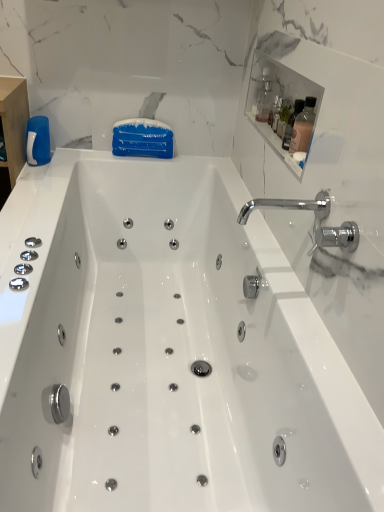
Where is `translucent pink bottle at upper right, the 2th bottle when ordered from back to front`? translucent pink bottle at upper right, the 2th bottle when ordered from back to front is located at coordinates (303, 127).

Measure the distance between point (314, 120) and camera.

A distance of 3.54 feet exists between point (314, 120) and camera.

Describe the element at coordinates (289, 206) in the screenshot. The width and height of the screenshot is (384, 512). I see `chrome/metallic faucet at upper right` at that location.

Where is `chrome/metallic faucet at upper right`? The height and width of the screenshot is (512, 384). chrome/metallic faucet at upper right is located at coordinates pyautogui.click(x=289, y=206).

In order to click on white glossy medicine cabinet at upper right in this screenshot , I will do `click(280, 105)`.

What do you see at coordinates (264, 102) in the screenshot? The width and height of the screenshot is (384, 512). I see `clear glass bottle at upper right, which ranks as the 2th bottle in front-to-back order` at bounding box center [264, 102].

Where is `translucent pink bottle at upper right, acting as the 1th bottle starting from the front`? This screenshot has width=384, height=512. translucent pink bottle at upper right, acting as the 1th bottle starting from the front is located at coordinates (303, 127).

Looking at this image, can you tell me how much clear glass bottle at upper right, the first bottle when ordered from back to front, and translucent pink bottle at upper right, acting as the 1th bottle starting from the front, differ in facing direction?

0.00192 degrees.

Which is behind, point (258, 115) or point (305, 100)?

The point (258, 115) is behind.

Visually, is clear glass bottle at upper right, the 2th bottle from the bottom, positioned to the left or to the right of translucent pink bottle at upper right, the 2th bottle when ordered from back to front?

In the image, clear glass bottle at upper right, the 2th bottle from the bottom, appears on the left side of translucent pink bottle at upper right, the 2th bottle when ordered from back to front.

Where is `bottle above the clear glass bottle at upper right, the first bottle when ordered from back to front (from a real-world perspective)`? Image resolution: width=384 pixels, height=512 pixels. bottle above the clear glass bottle at upper right, the first bottle when ordered from back to front (from a real-world perspective) is located at coordinates (303, 127).

Can you confirm if blue glossy bottle at left is bigger than translucent pink bottle at upper right, the 2th bottle when ordered from back to front?

Yes.

Between blue glossy bottle at left and translucent pink bottle at upper right, marked as the 1th bottle in a bottom-to-top arrangement, which one has more height?

translucent pink bottle at upper right, marked as the 1th bottle in a bottom-to-top arrangement.

Is the surface of blue glossy bottle at left in direct contact with translucent pink bottle at upper right, acting as the 1th bottle starting from the front?

No, blue glossy bottle at left is not next to translucent pink bottle at upper right, acting as the 1th bottle starting from the front.

Starting from the blue glossy bottle at left, which bottle is the 2nd one in front? Please provide its 2D coordinates.

[(303, 127)]

Is translucent pink bottle at upper right, acting as the 1th bottle starting from the front, aimed at white glossy bathtub at center?

No.

Which is more to the left, translucent pink bottle at upper right, marked as the 1th bottle in a bottom-to-top arrangement, or white glossy bathtub at center?

From the viewer's perspective, white glossy bathtub at center appears more on the left side.

Is white glossy bathtub at center surrounded by translucent pink bottle at upper right, marked as the 1th bottle in a bottom-to-top arrangement?

No, white glossy bathtub at center is not surrounded by translucent pink bottle at upper right, marked as the 1th bottle in a bottom-to-top arrangement.

How different are the orientations of translucent pink bottle at upper right, marked as the 1th bottle in a bottom-to-top arrangement, and white glossy bathtub at center in degrees?

0.742 degrees separate the facing orientations of translucent pink bottle at upper right, marked as the 1th bottle in a bottom-to-top arrangement, and white glossy bathtub at center.

Can you tell me how much chrome/metallic faucet at upper right and white glossy medicine cabinet at upper right differ in facing direction?

chrome/metallic faucet at upper right and white glossy medicine cabinet at upper right are facing 0.000904 degrees away from each other.

Consider the image. Is chrome/metallic faucet at upper right inside the boundaries of white glossy medicine cabinet at upper right, or outside?

chrome/metallic faucet at upper right is spatially situated outside white glossy medicine cabinet at upper right.

Can you confirm if chrome/metallic faucet at upper right is taller than white glossy medicine cabinet at upper right?

Yes, chrome/metallic faucet at upper right is taller than white glossy medicine cabinet at upper right.

Does chrome/metallic faucet at upper right come behind white glossy medicine cabinet at upper right?

No, chrome/metallic faucet at upper right is in front of white glossy medicine cabinet at upper right.

In the image, is white glossy medicine cabinet at upper right positioned in front of or behind translucent pink bottle at upper right, which is the second bottle from top to bottom?

Visually, white glossy medicine cabinet at upper right is located in front of translucent pink bottle at upper right, which is the second bottle from top to bottom.

Can you confirm if white glossy medicine cabinet at upper right is taller than translucent pink bottle at upper right, which is the second bottle from top to bottom?

Incorrect, the height of white glossy medicine cabinet at upper right is not larger of that of translucent pink bottle at upper right, which is the second bottle from top to bottom.

Consider the image. From a real-world perspective, relative to translucent pink bottle at upper right, which is the second bottle from top to bottom, is white glossy medicine cabinet at upper right vertically above or below?

white glossy medicine cabinet at upper right is situated lower than translucent pink bottle at upper right, which is the second bottle from top to bottom, in the real world.

Which of these two, white glossy medicine cabinet at upper right or translucent pink bottle at upper right, acting as the 1th bottle starting from the front, is thinner?

Thinner between the two is translucent pink bottle at upper right, acting as the 1th bottle starting from the front.

Is translucent pink bottle at upper right, which is the second bottle from top to bottom, facing towards chrome/metallic faucet at upper right?

No.

Is point (311, 127) less distant than point (329, 209)?

No, (311, 127) is further to viewer.

Looking at this image, considering the sizes of objects translucent pink bottle at upper right, acting as the 1th bottle starting from the front, and chrome/metallic faucet at upper right in the image provided, who is shorter, translucent pink bottle at upper right, acting as the 1th bottle starting from the front, or chrome/metallic faucet at upper right?

With less height is chrome/metallic faucet at upper right.

Is chrome/metallic faucet at upper right positioned behind blue glossy bottle at left?

That is False.

Is chrome/metallic faucet at upper right with blue glossy bottle at left?

No.

Consider the image. Which is nearer, (326, 193) or (42, 121)?

Positioned in front is point (326, 193).

Does chrome/metallic faucet at upper right appear on the right side of blue glossy bottle at left?

Correct, you'll find chrome/metallic faucet at upper right to the right of blue glossy bottle at left.

Where is `bottle above the translucent pink bottle at upper right, which is the second bottle from top to bottom (from the image's perspective)`? Image resolution: width=384 pixels, height=512 pixels. bottle above the translucent pink bottle at upper right, which is the second bottle from top to bottom (from the image's perspective) is located at coordinates (264, 102).

The height and width of the screenshot is (512, 384). I want to click on cleaning product that appears on the left of translucent pink bottle at upper right, which is the second bottle from top to bottom, so click(38, 141).

Estimate the real-world distances between objects in this image. Which object is further from translucent pink bottle at upper right, the 2th bottle when ordered from back to front, clear glass bottle at upper right, the first bottle when ordered from back to front, or blue glossy bottle at left?

blue glossy bottle at left is positioned further to the anchor translucent pink bottle at upper right, the 2th bottle when ordered from back to front.

When comparing their distances from chrome/metallic faucet at upper right, does translucent pink bottle at upper right, the 2th bottle when ordered from back to front, or white glossy medicine cabinet at upper right seem further?

The object further to chrome/metallic faucet at upper right is white glossy medicine cabinet at upper right.

When comparing their distances from blue glossy bottle at left, does white glossy bathtub at center or white glossy medicine cabinet at upper right seem further?

white glossy medicine cabinet at upper right lies further to blue glossy bottle at left than the other object.

Based on their spatial positions, is clear glass bottle at upper right, the first bottle when ordered from back to front, or translucent pink bottle at upper right, acting as the 1th bottle starting from the front, further from blue glossy bottle at left?

translucent pink bottle at upper right, acting as the 1th bottle starting from the front, is further to blue glossy bottle at left.

From the image, which object appears to be farther from translucent pink bottle at upper right, acting as the 1th bottle starting from the front, chrome/metallic faucet at upper right or white glossy medicine cabinet at upper right?

white glossy medicine cabinet at upper right.

When comparing their distances from chrome/metallic faucet at upper right, does clear glass bottle at upper right, which ranks as the 2th bottle in front-to-back order, or white glossy bathtub at center seem further?

Based on the image, white glossy bathtub at center appears to be further to chrome/metallic faucet at upper right.

Considering their positions, is blue glossy bottle at left positioned further to translucent pink bottle at upper right, the 2th bottle when ordered from back to front, than white glossy bathtub at center?

The object further to translucent pink bottle at upper right, the 2th bottle when ordered from back to front, is blue glossy bottle at left.

Looking at the image, which one is located further to white glossy medicine cabinet at upper right, chrome/metallic faucet at upper right or white glossy bathtub at center?

white glossy bathtub at center is further to white glossy medicine cabinet at upper right.

Where is `bottle positioned between white glossy bathtub at center and clear glass bottle at upper right, which is the 1th bottle from top to bottom, from near to far`? bottle positioned between white glossy bathtub at center and clear glass bottle at upper right, which is the 1th bottle from top to bottom, from near to far is located at coordinates (303, 127).

Identify the location of tap between blue glossy bottle at left and translucent pink bottle at upper right, the 2th bottle when ordered from back to front. The height and width of the screenshot is (512, 384). (289, 206).

The image size is (384, 512). Identify the location of tap between white glossy bathtub at center and blue glossy bottle at left from front to back. (289, 206).

Find the location of a particular element. tap between white glossy bathtub at center and translucent pink bottle at upper right, marked as the 1th bottle in a bottom-to-top arrangement, in the front-back direction is located at coordinates (289, 206).